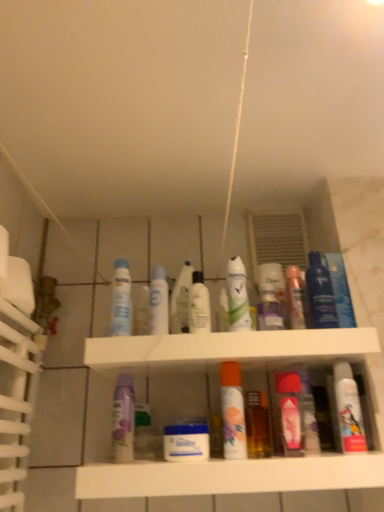
Question: Is white glossy mouthwash at center, which is the second mouthwash in left-to-right order, further to the viewer compared to matte purple lotion at center, which is the 2th toiletry from right to left?

Choices:
 (A) yes
 (B) no

Answer: (B)

Question: Does white glossy mouthwash at center, which is the second mouthwash in left-to-right order, have a lesser width compared to matte purple lotion at center, the 1th toiletry positioned from the left?

Choices:
 (A) no
 (B) yes

Answer: (B)

Question: Is white glossy mouthwash at center, arranged as the 9th mouthwash when viewed from the right, taller than matte purple lotion at center, the 1th toiletry positioned from the left?

Choices:
 (A) no
 (B) yes

Answer: (B)

Question: Is white glossy mouthwash at center, which is the second mouthwash in left-to-right order, facing away from matte purple lotion at center, which is the 2th toiletry from right to left?

Choices:
 (A) no
 (B) yes

Answer: (A)

Question: From a real-world perspective, is white glossy mouthwash at center, which is the second mouthwash in left-to-right order, positioned under matte purple lotion at center, which is the 2th toiletry from right to left, based on gravity?

Choices:
 (A) no
 (B) yes

Answer: (A)

Question: Would you say white plastic shelf at center is to the left or to the right of white glossy mouthwash at center, which is the second mouthwash in left-to-right order, in the picture?

Choices:
 (A) left
 (B) right

Answer: (B)

Question: From a real-world perspective, is white plastic shelf at center positioned above or below white glossy mouthwash at center, arranged as the 9th mouthwash when viewed from the right?

Choices:
 (A) above
 (B) below

Answer: (B)

Question: Relative to white glossy mouthwash at center, arranged as the 9th mouthwash when viewed from the right, is white plastic shelf at center in front or behind?

Choices:
 (A) behind
 (B) front

Answer: (B)

Question: In terms of height, does white plastic shelf at center look taller or shorter compared to white glossy mouthwash at center, arranged as the 9th mouthwash when viewed from the right?

Choices:
 (A) short
 (B) tall

Answer: (B)

Question: Considering their positions, is matte white spray can at center, marked as the first cleaning product in a left-to-right arrangement, located in front of or behind matte pink spray can at center, positioned as the second cleaning product in left-to-right order?

Choices:
 (A) front
 (B) behind

Answer: (B)

Question: Visually, is matte white spray can at center, the 1th cleaning product from the top, positioned to the left or to the right of matte pink spray can at center, the second cleaning product in the top-to-bottom sequence?

Choices:
 (A) left
 (B) right

Answer: (A)

Question: Is matte white spray can at center, marked as the first cleaning product in a left-to-right arrangement, inside the boundaries of matte pink spray can at center, positioned as the second cleaning product in left-to-right order, or outside?

Choices:
 (A) outside
 (B) inside

Answer: (A)

Question: From their relative heights in the image, would you say matte white spray can at center, marked as the first cleaning product in a left-to-right arrangement, is taller or shorter than matte pink spray can at center, arranged as the 1th cleaning product when ordered from the bottom?

Choices:
 (A) short
 (B) tall

Answer: (A)

Question: From a real-world perspective, relative to matte purple lotion at center, which is the 2th toiletry from right to left, is blue glossy mouthwash at upper right, the 2th mouthwash positioned from the right, vertically above or below?

Choices:
 (A) below
 (B) above

Answer: (B)

Question: Is point (332, 318) closer or farther from the camera than point (271, 310)?

Choices:
 (A) farther
 (B) closer

Answer: (B)